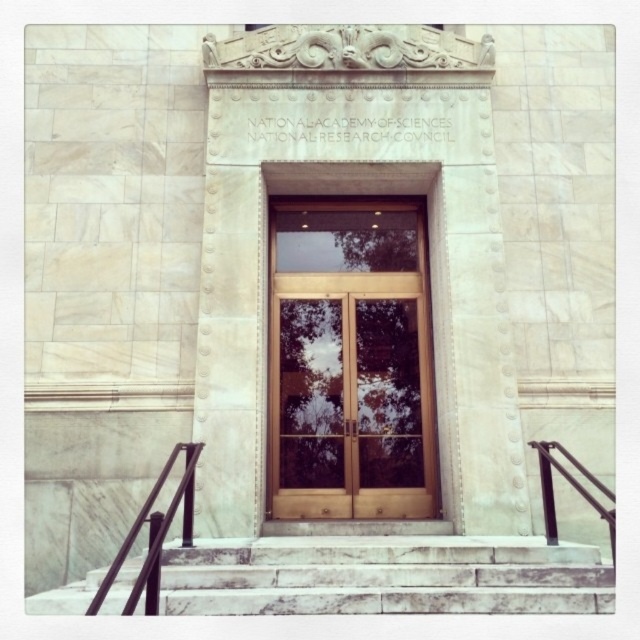
Is white marble stairs at center to the left of black metal railing at right from the viewer's perspective?

Correct, you'll find white marble stairs at center to the left of black metal railing at right.

This screenshot has width=640, height=640. I want to click on white marble stairs at center, so click(x=385, y=576).

Identify the location of white marble stairs at center. Image resolution: width=640 pixels, height=640 pixels. (385, 576).

Does point (378, 321) come farther from viewer compared to point (556, 544)?

Yes.

Does glossy wood door at center appear under black metal railing at right?

Incorrect, glossy wood door at center is not positioned below black metal railing at right.

Where is `glossy wood door at center`? The width and height of the screenshot is (640, 640). glossy wood door at center is located at coordinates (349, 406).

Does glossy wood door at center have a larger size compared to black metal railing at lower left?

Yes.

Does glossy wood door at center have a lesser width compared to black metal railing at lower left?

No.

Between point (404, 476) and point (170, 458), which one is positioned in front?

Point (170, 458)

Where is `glossy wood door at center`? The width and height of the screenshot is (640, 640). glossy wood door at center is located at coordinates (349, 406).